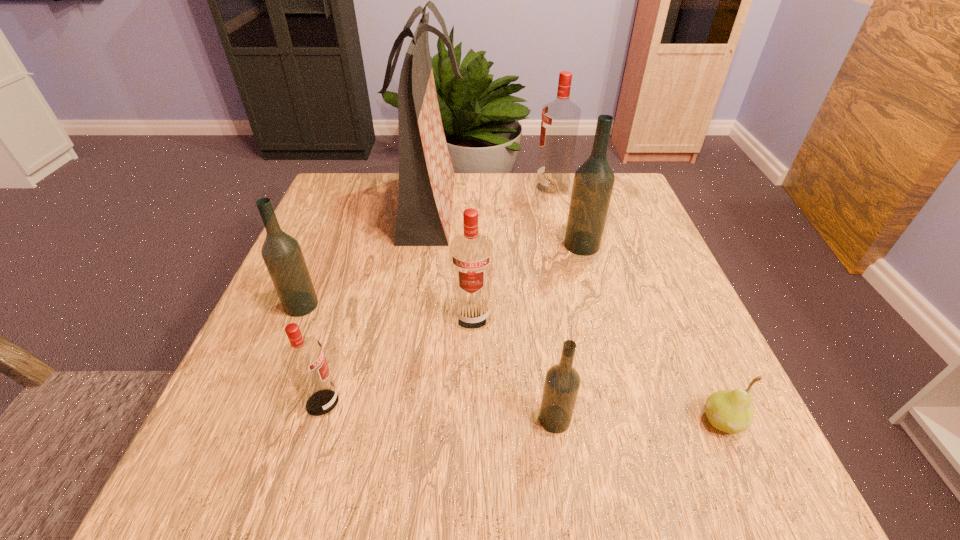
Image resolution: width=960 pixels, height=540 pixels. Identify the location of vacant point at the left edge. pyautogui.click(x=358, y=224).

You are a GUI agent. You are given a task and a screenshot of the screen. Output one action in this format:
    pyautogui.click(x=<x>, y=<y>)
    Task: Click on the vacant area at the right edge
    The image size is (960, 540).
    Given the screenshot: What is the action you would take?
    point(703,336)

In the image, there is a desktop. In order to click on vacant space at the far left corner in this screenshot , I will do click(322, 211).

This screenshot has width=960, height=540. I want to click on free space at the near left corner, so click(x=210, y=443).

Where is `unoccupied area between the second red vodka from left to right and the leftmost vodka`? This screenshot has height=540, width=960. unoccupied area between the second red vodka from left to right and the leftmost vodka is located at coordinates (387, 311).

Image resolution: width=960 pixels, height=540 pixels. I want to click on vacant area between the leftmost object and the rightmost red vodka, so click(x=427, y=246).

Locate an element on the screen. This screenshot has width=960, height=540. vacant area between the farthest black vodka and the second smallest black vodka is located at coordinates (442, 275).

Identify the location of free spot between the leftmost red vodka and the smallest black vodka. The image size is (960, 540). 439,411.

Identify the location of vacant space that's between the nearest red vodka and the shopping bag. (376, 305).

You are a GUI agent. You are given a task and a screenshot of the screen. Output one action in this format:
    pyautogui.click(x=<x>, y=<y>)
    Task: Click on the free space between the second farthest vodka and the second red vodka from right to left
    
    Given the screenshot: What is the action you would take?
    pyautogui.click(x=527, y=281)